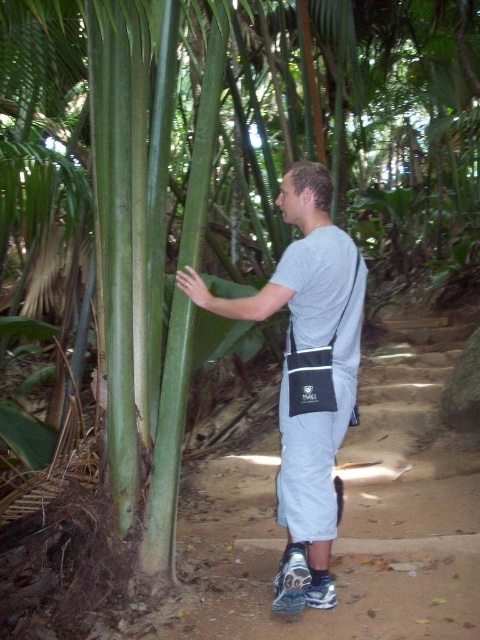
You are a fashion designer observing a man in a tropical forest. You notice the gray fabric shirt at center and the gray fabric bag at center. Which of these two items is bigger in size?

The gray fabric shirt at center has a larger size compared to the gray fabric bag at center.

You are a photographer trying to capture the man in the scene. You want to ensure both the gray fabric shirt at center and the gray fabric bag at center are visible in your shot. Based on their positions, which object should you focus on first to frame both in the same photo?

The gray fabric shirt at center is to the left of the gray fabric bag at center, so you should focus on the gray fabric bag at center first to ensure both are framed in the photo.

You are a photographer trying to capture the man in the tropical forest. You want to ensure that both the gray fabric shirt at center and the gray fabric bag at center are clearly visible in the photo. Given their proximity, do you think you can focus on both subjects simultaneously?

The gray fabric shirt at center is 2.06 inches away from the gray fabric bag at center, so yes, you can focus on both subjects simultaneously as they are close enough for the camera to capture both in focus.